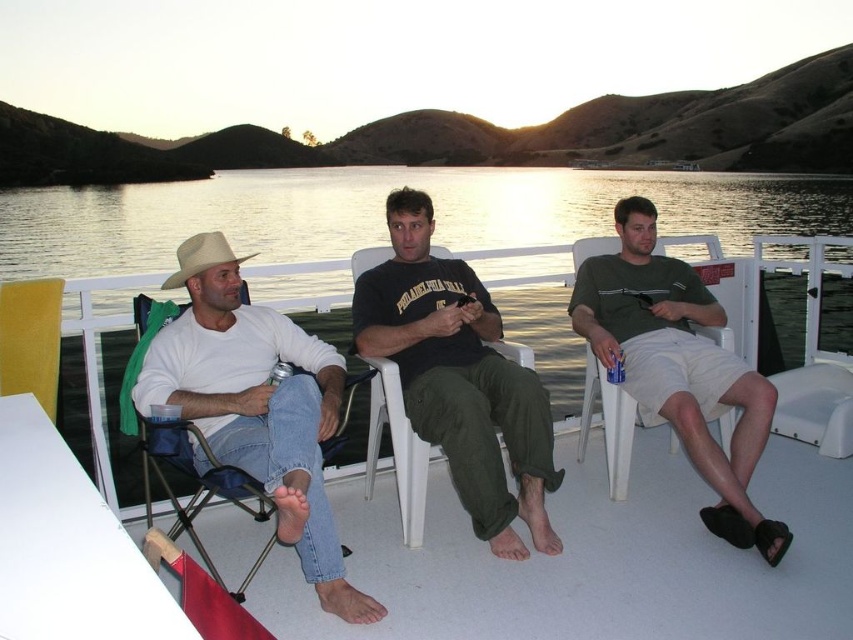
The width and height of the screenshot is (853, 640). I want to click on white plastic deck at center, so click(x=592, y=560).

Locate an element on the screen. The image size is (853, 640). white plastic deck at center is located at coordinates coord(592,560).

Can you confirm if black matte shirt at center is positioned below yellow fabric chair at left?

Indeed, black matte shirt at center is positioned under yellow fabric chair at left.

Does black matte shirt at center have a greater width compared to yellow fabric chair at left?

Yes, black matte shirt at center is wider than yellow fabric chair at left.

Is point (492, 321) less distant than point (39, 378)?

No, it is not.

You are a GUI agent. You are given a task and a screenshot of the screen. Output one action in this format:
    pyautogui.click(x=<x>, y=<y>)
    Task: Click on the black matte shirt at center
    
    Given the screenshot: What is the action you would take?
    pyautogui.click(x=459, y=378)

Does glistening water at center appear on the right side of beige felt cowboy hat at left?

Yes, glistening water at center is to the right of beige felt cowboy hat at left.

Measure the distance between point (759, 209) and camera.

The distance of point (759, 209) from camera is 27.86 meters.

Is point (712, 196) closer to viewer compared to point (172, 276)?

No, (712, 196) is behind (172, 276).

This screenshot has height=640, width=853. In order to click on glistening water at center in this screenshot , I will do click(381, 211).